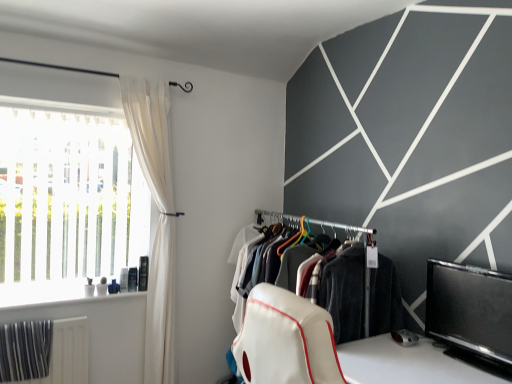
Identify the location of blank space above white translucent blinds at left (from a real-world perspective). (72, 107).